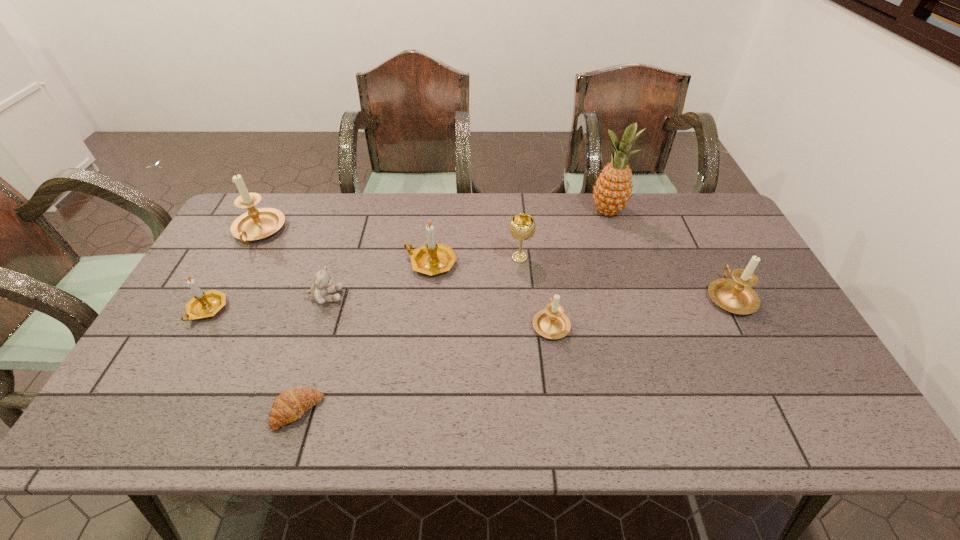
Find the location of a particular element. Image resolution: width=960 pixels, height=540 pixels. free spot between the nearer gold candle holder and the leftmost beige candle holder is located at coordinates (233, 271).

Locate which object is the closest to the nearer gold candle holder. Please provide its 2D coordinates. Your answer should be formatted as a tuple, i.e. [(x, y)], where the tuple contains the x and y coordinates of a point satisfying the conditions above.

[(255, 224)]

Select which object appears as the fourth closest to the shortest object. Please provide its 2D coordinates. Your answer should be formatted as a tuple, i.e. [(x, y)], where the tuple contains the x and y coordinates of a point satisfying the conditions above.

[(255, 224)]

Select which candle holder appears as the fourth closest to the chalice. Please provide its 2D coordinates. Your answer should be formatted as a tuple, i.e. [(x, y)], where the tuple contains the x and y coordinates of a point satisfying the conditions above.

[(255, 224)]

Where is `candle holder that is the second closest to the nearer gold candle holder`? candle holder that is the second closest to the nearer gold candle holder is located at coordinates (433, 258).

Locate an element on the screen. beige candle holder that stands as the closest to the chalice is located at coordinates (552, 323).

Where is `the closest beige candle holder to the fourth candle holder from left to right`? Image resolution: width=960 pixels, height=540 pixels. the closest beige candle holder to the fourth candle holder from left to right is located at coordinates (734, 295).

I want to click on free spot that satisfies the following two spatial constraints: 1. with a handle on the side of the leftmost beige candle holder; 2. on the right side of the chalice, so click(245, 258).

Where is `blank space that satisfies the following two spatial constraints: 1. on the back side of the chalice; 2. on the left side of the bigger gold candle holder`? Image resolution: width=960 pixels, height=540 pixels. blank space that satisfies the following two spatial constraints: 1. on the back side of the chalice; 2. on the left side of the bigger gold candle holder is located at coordinates (431, 258).

This screenshot has height=540, width=960. Identify the location of vacant space that satisfies the following two spatial constraints: 1. with a handle on the side of the tallest candle holder; 2. on the right side of the chalice. (245, 258).